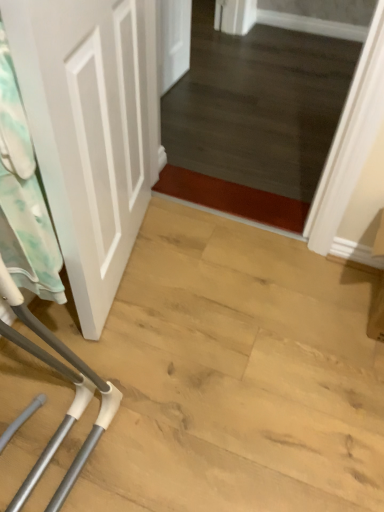
Image resolution: width=384 pixels, height=512 pixels. Describe the element at coordinates (91, 130) in the screenshot. I see `white matte door at left` at that location.

What is the approximate height of white matte door at left?

white matte door at left is 23.11 inches tall.

Where is `white matte door at left`? white matte door at left is located at coordinates (91, 130).

What do you see at coordinates (23, 196) in the screenshot?
I see `white fabric laundry at left` at bounding box center [23, 196].

Identify the location of white fabric laundry at left. The image size is (384, 512). (23, 196).

Where is `white matte door at left`? white matte door at left is located at coordinates (91, 130).

Consider the image. Would you say white fabric laundry at left is to the left or to the right of white matte door at left in the picture?

In the image, white fabric laundry at left appears on the left side of white matte door at left.

Does white fabric laundry at left come in front of white matte door at left?

No, it is not.

Considering the positions of point (0, 42) and point (80, 44), is point (0, 42) closer or farther from the camera than point (80, 44)?

Clearly, point (0, 42) is closer to the camera than point (80, 44).

From the image's perspective, is white fabric laundry at left above white matte door at left?

No, from the image's perspective, white fabric laundry at left is not on top of white matte door at left.

Based on the photo, from a real-world perspective, which object stands above the other?

white matte door at left is physically above.

Between white fabric laundry at left and white matte door at left, which one has larger width?

With larger width is white matte door at left.

In terms of height, does white fabric laundry at left look taller or shorter compared to white matte door at left?

white fabric laundry at left is shorter than white matte door at left.

Is white fabric laundry at left smaller than white matte door at left?

Result: Yes.

Would you say white matte door at left is part of white fabric laundry at left's contents?

Actually, white matte door at left is outside white fabric laundry at left.

Are white fabric laundry at left and white matte door at left located far from each other?

That's not correct — white fabric laundry at left is a little close to white matte door at left.

Consider the image. Is white fabric laundry at left oriented towards white matte door at left?

Yes, white fabric laundry at left is oriented towards white matte door at left.

How different are the orientations of white fabric laundry at left and white matte door at left in degrees?

The facing directions of white fabric laundry at left and white matte door at left are 4.87 degrees apart.

Where is `door above the white fabric laundry at left (from a real-world perspective)`? door above the white fabric laundry at left (from a real-world perspective) is located at coordinates (91, 130).

Considering the positions of objects white matte door at left and white fabric laundry at left in the image provided, who is more to the right, white matte door at left or white fabric laundry at left?

From the viewer's perspective, white matte door at left appears more on the right side.

Is white matte door at left behind white fabric laundry at left?

That is False.

Considering the positions of point (144, 180) and point (29, 236), is point (144, 180) closer or farther from the camera than point (29, 236)?

Point (144, 180).

From the picture: From the image's perspective, is white matte door at left over white fabric laundry at left?

Yes, from the image's perspective, white matte door at left is on top of white fabric laundry at left.

From a real-world perspective, which is physically above, white matte door at left or white fabric laundry at left?

From a 3D spatial view, white matte door at left is above.

Does white matte door at left have a lesser width compared to white fabric laundry at left?

No.

In terms of height, does white matte door at left look taller or shorter compared to white fabric laundry at left?

white matte door at left is taller than white fabric laundry at left.

Considering the sizes of objects white matte door at left and white fabric laundry at left in the image provided, who is smaller, white matte door at left or white fabric laundry at left?

Smaller between the two is white fabric laundry at left.

Is white matte door at left inside or outside of white fabric laundry at left?

white matte door at left is located beyond the bounds of white fabric laundry at left.

Is white matte door at left with white fabric laundry at left?

white matte door at left and white fabric laundry at left are clearly separated.

Is white matte door at left facing away from white fabric laundry at left?

Absolutely, white matte door at left is directed away from white fabric laundry at left.

How different are the orientations of white matte door at left and white fabric laundry at left in degrees?

4.87 degrees.

The width and height of the screenshot is (384, 512). I want to click on door above the white fabric laundry at left (from a real-world perspective), so click(x=91, y=130).

The width and height of the screenshot is (384, 512). I want to click on door on the right of white fabric laundry at left, so coord(91,130).

You are a GUI agent. You are given a task and a screenshot of the screen. Output one action in this format:
    pyautogui.click(x=<x>, y=<y>)
    Task: Click on the door in front of the white fabric laundry at left
    This screenshot has height=512, width=384.
    Given the screenshot: What is the action you would take?
    pyautogui.click(x=91, y=130)